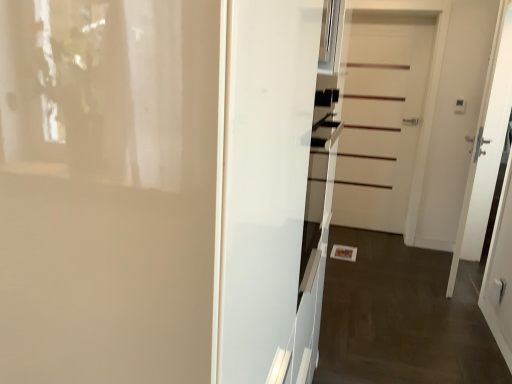
Question: Is white glossy door at center, acting as the 1th door starting from the left, behind white matte door at center, which appears as the third door when viewed from the front?

Choices:
 (A) no
 (B) yes

Answer: (A)

Question: Can you confirm if white glossy door at center, acting as the 1th door starting from the left, is bigger than white matte door at center, marked as the 1th door in a back-to-front arrangement?

Choices:
 (A) yes
 (B) no

Answer: (A)

Question: From a real-world perspective, is white glossy door at center, placed as the 3th door when sorted from right to left, positioned under white matte door at center, the 2th door viewed from the left, based on gravity?

Choices:
 (A) yes
 (B) no

Answer: (A)

Question: Is white glossy door at center, placed as the 3th door when sorted from right to left, in contact with white matte door at center, the 2th door viewed from the left?

Choices:
 (A) no
 (B) yes

Answer: (A)

Question: Can you confirm if white glossy door at center, the third door in the back-to-front sequence, is thinner than white matte door at center, the 2th door viewed from the left?

Choices:
 (A) no
 (B) yes

Answer: (A)

Question: Considering the relative positions of white glossy oven at center and white glossy door at center, which ranks as the 1th door in front-to-back order, in the image provided, is white glossy oven at center to the left or to the right of white glossy door at center, which ranks as the 1th door in front-to-back order,?

Choices:
 (A) left
 (B) right

Answer: (B)

Question: Considering the positions of point (308, 205) and point (64, 38), is point (308, 205) closer or farther from the camera than point (64, 38)?

Choices:
 (A) farther
 (B) closer

Answer: (A)

Question: From the image's perspective, is white glossy oven at center positioned above or below white glossy door at center, the third door in the back-to-front sequence?

Choices:
 (A) above
 (B) below

Answer: (A)

Question: Is white glossy oven at center situated inside white glossy door at center, acting as the 1th door starting from the left, or outside?

Choices:
 (A) outside
 (B) inside

Answer: (B)

Question: In the image, is white matte door at center, which appears as the third door when viewed from the front, on the left side or the right side of white glossy door at center, acting as the 1th door starting from the left?

Choices:
 (A) left
 (B) right

Answer: (B)

Question: Does point (399, 168) appear closer or farther from the camera than point (126, 119)?

Choices:
 (A) closer
 (B) farther

Answer: (B)

Question: Which is correct: white matte door at center, marked as the 1th door in a back-to-front arrangement, is inside white glossy door at center, placed as the 3th door when sorted from right to left, or outside of it?

Choices:
 (A) outside
 (B) inside

Answer: (A)

Question: Based on their sizes in the image, would you say white matte door at center, the 2th door viewed from the left, is bigger or smaller than white glossy door at center, the third door in the back-to-front sequence?

Choices:
 (A) small
 (B) big

Answer: (A)

Question: From the image's perspective, is white glossy oven at center located above or below white matte door at center, the 2th door viewed from the left?

Choices:
 (A) below
 (B) above

Answer: (A)

Question: Is white glossy oven at center inside or outside of white matte door at center, marked as the second door in a right-to-left arrangement?

Choices:
 (A) outside
 (B) inside

Answer: (A)